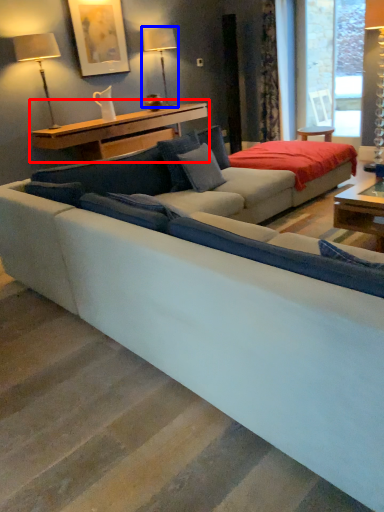
Question: Which of the following is the closest to the observer, table (highlighted by a red box) or table lamp (highlighted by a blue box)?

Choices:
 (A) table
 (B) table lamp

Answer: (A)